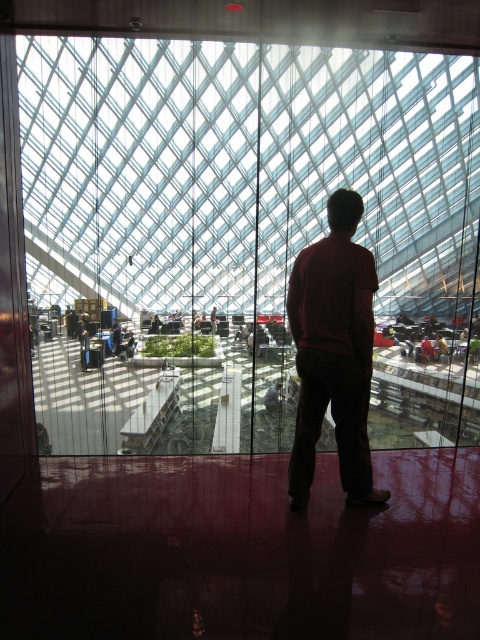
Which of these two, transparent glass window at center or dark red sweater at center, stands taller?

Standing taller between the two is transparent glass window at center.

Who is shorter, transparent glass window at center or dark red sweater at center?

With less height is dark red sweater at center.

Who is more distant from viewer, (47, 300) or (337, 196)?

The point (47, 300) is more distant.

The width and height of the screenshot is (480, 640). Identify the location of transparent glass window at center. (241, 228).